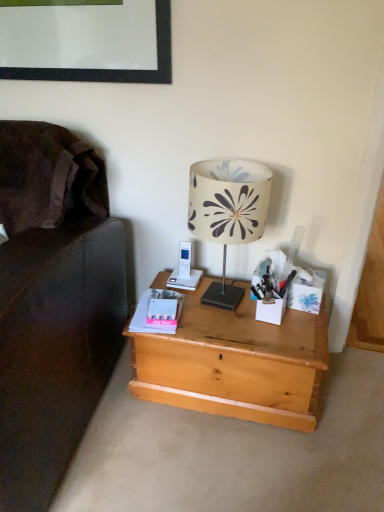
At what (x,y) coordinates should I click in order to perform the action: click on vacant point above natural wood desk at center (from a real-world perspective). Please return your answer as a coordinate pair (x, y). This screenshot has height=512, width=384. Looking at the image, I should click on [x=233, y=318].